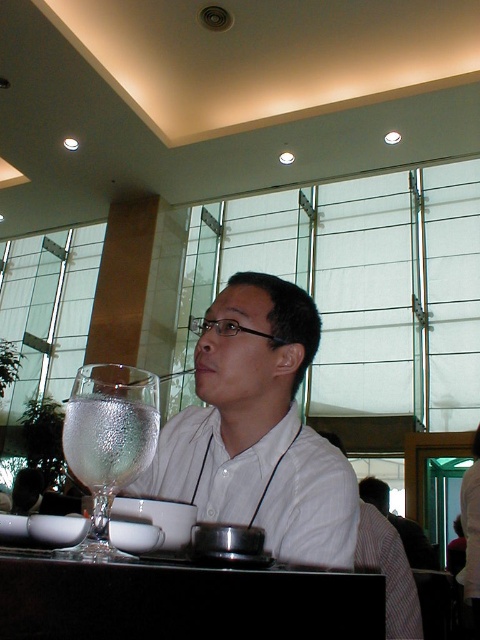
In the scene shown: Is white shirt at center positioned at the back of clear glass water at left?

Yes, white shirt at center is behind clear glass water at left.

Who is positioned more to the left, white shirt at center or clear glass water at left?

Positioned to the left is clear glass water at left.

What do you see at coordinates (257, 429) in the screenshot? I see `white shirt at center` at bounding box center [257, 429].

The image size is (480, 640). Find the location of `white shirt at center`. white shirt at center is located at coordinates (257, 429).

Who is higher up, black glossy table at lower center or clear glass water at left?

Positioned higher is clear glass water at left.

Is black glossy table at lower center closer to camera compared to clear glass water at left?

Yes, black glossy table at lower center is closer to the viewer.

You are a GUI agent. You are given a task and a screenshot of the screen. Output one action in this format:
    pyautogui.click(x=<x>, y=<y>)
    Task: Click on the black glossy table at lower center
    
    Given the screenshot: What is the action you would take?
    pyautogui.click(x=182, y=602)

Is point (316, 474) less distant than point (34, 580)?

No, it is behind (34, 580).

Does white shirt at center have a lesser height compared to black glossy table at lower center?

In fact, white shirt at center may be taller than black glossy table at lower center.

What do you see at coordinates (257, 429) in the screenshot? I see `white shirt at center` at bounding box center [257, 429].

I want to click on white shirt at center, so click(x=257, y=429).